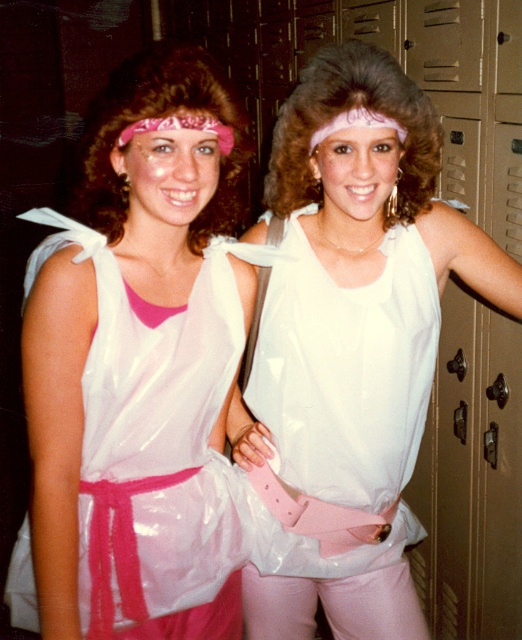
Question: Can you confirm if matte white tank top at center is positioned above white glossy dress at center?

Choices:
 (A) no
 (B) yes

Answer: (B)

Question: Among these points, which one is nearest to the camera?

Choices:
 (A) (274, 268)
 (B) (397, 204)

Answer: (A)

Question: Is matte plastic toga at center smaller than white glossy dress at center?

Choices:
 (A) no
 (B) yes

Answer: (A)

Question: Does matte plastic toga at center lie behind white glossy dress at center?

Choices:
 (A) yes
 (B) no

Answer: (B)

Question: Which point is closer to the camera?

Choices:
 (A) matte white tank top at center
 (B) white glossy dress at center

Answer: (A)

Question: Among these objects, which one is farthest from the camera?

Choices:
 (A) white glossy dress at center
 (B) matte white tank top at center

Answer: (A)